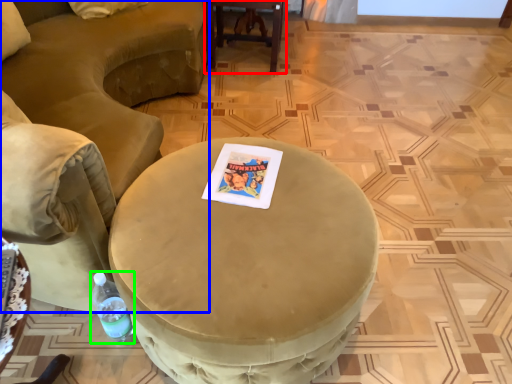
Question: Considering the real-world distances, which object is farthest from table (highlighted by a red box)? chair (highlighted by a blue box) or bottle (highlighted by a green box)?

Choices:
 (A) chair
 (B) bottle

Answer: (B)